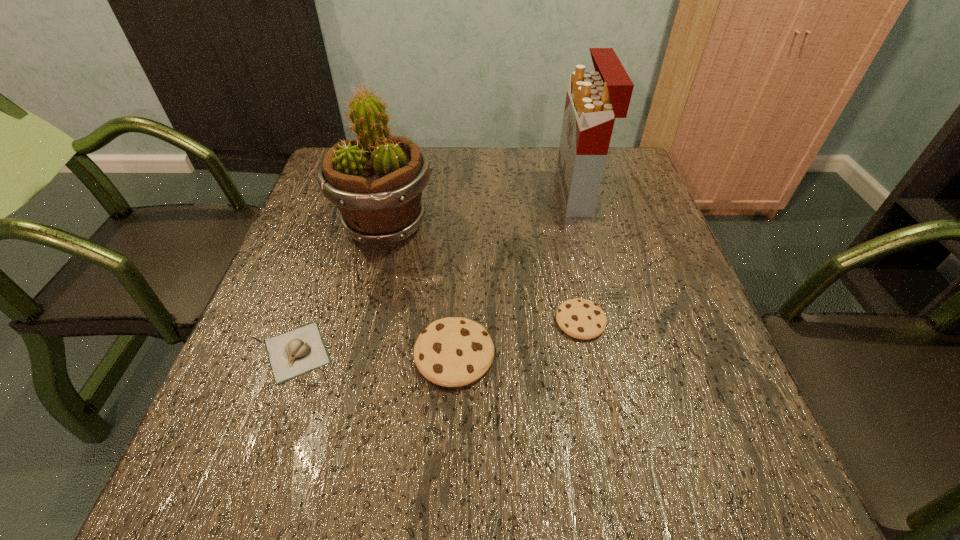
Locate an element on the screen. vacant space that is in between the cigarette case and the right cookie is located at coordinates (579, 257).

At what (x,y) coordinates should I click in order to perform the action: click on free space that is in between the cigarette case and the garlic. Please return your answer as a coordinate pair (x, y). The width and height of the screenshot is (960, 540). Looking at the image, I should click on (438, 272).

Point out which object is positioned as the third nearest to the shorter cookie. Please provide its 2D coordinates. Your answer should be formatted as a tuple, i.e. [(x, y)], where the tuple contains the x and y coordinates of a point satisfying the conditions above.

[(376, 180)]

Identify which object is located as the third nearest to the cigarette case. Please provide its 2D coordinates. Your answer should be formatted as a tuple, i.e. [(x, y)], where the tuple contains the x and y coordinates of a point satisfying the conditions above.

[(452, 352)]

Find the location of a particular element. This screenshot has width=960, height=540. free space in the image that satisfies the following two spatial constraints: 1. on the back side of the second shortest object; 2. on the right side of the garlic is located at coordinates (308, 321).